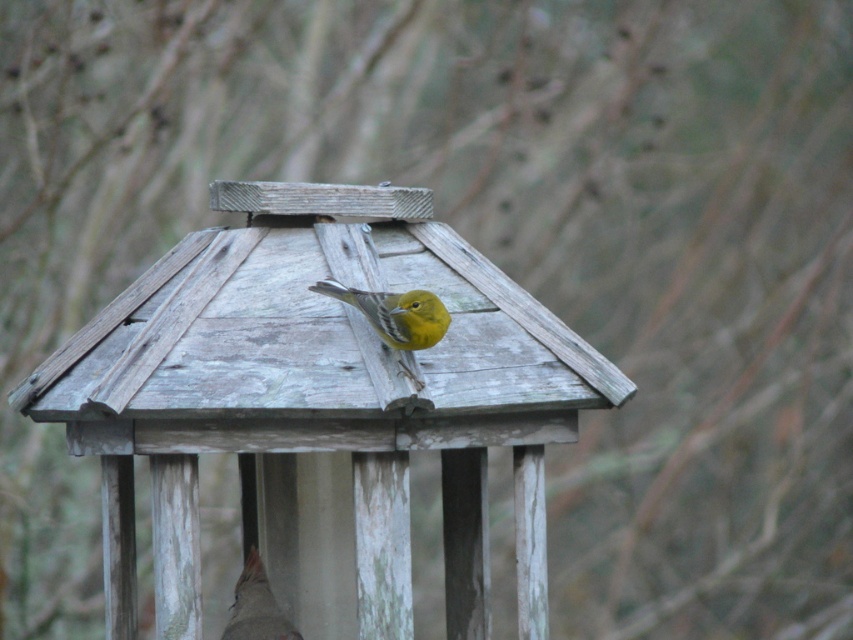
Which is behind, point (187, 589) or point (403, 307)?

The point (403, 307) is more distant.

Who is lower down, weathered wood bird feeder at center or yellow matte bird at center?

weathered wood bird feeder at center

The height and width of the screenshot is (640, 853). Describe the element at coordinates (318, 410) in the screenshot. I see `weathered wood bird feeder at center` at that location.

Identify the location of weathered wood bird feeder at center. The image size is (853, 640). (318, 410).

Is yellow matte bird at center shorter than matte brown bird at center?

No, yellow matte bird at center is not shorter than matte brown bird at center.

Between point (386, 314) and point (251, 625), which one is positioned behind?

Point (251, 625)

The width and height of the screenshot is (853, 640). In order to click on yellow matte bird at center in this screenshot , I will do `click(393, 314)`.

Does weathered wood bird feeder at center have a greater width compared to matte brown bird at center?

Yes, weathered wood bird feeder at center is wider than matte brown bird at center.

Between weathered wood bird feeder at center and matte brown bird at center, which one is positioned higher?

weathered wood bird feeder at center is higher up.

Is point (468, 538) positioned in front of point (263, 593)?

No, it is not.

Image resolution: width=853 pixels, height=640 pixels. I want to click on weathered wood bird feeder at center, so click(318, 410).